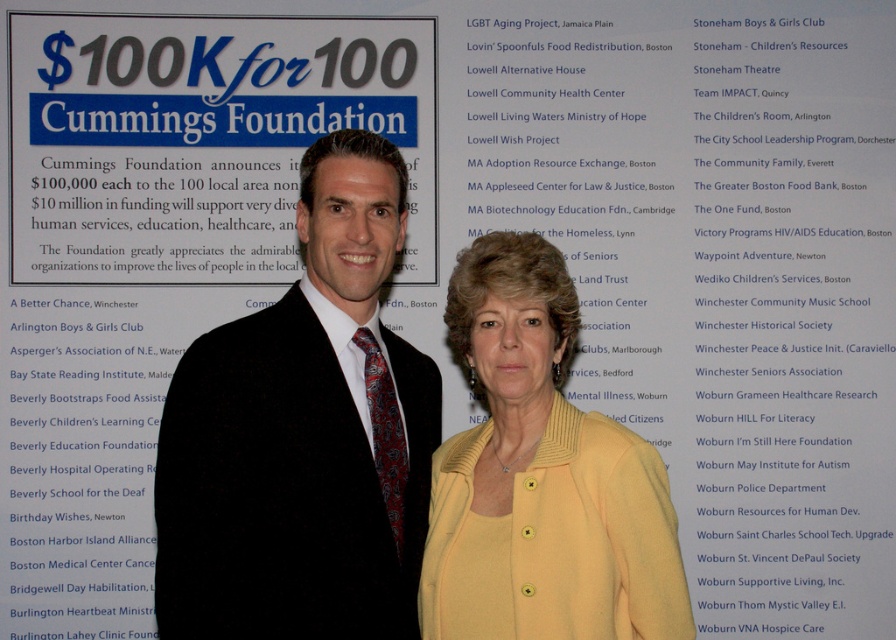
Question: Which object appears closest to the camera in this image?

Choices:
 (A) black velvet suit at center
 (B) yellow matte cardigan at center

Answer: (A)

Question: Which of the following is the closest to the observer?

Choices:
 (A) black velvet suit at center
 (B) yellow matte cardigan at center

Answer: (A)

Question: Where is black velvet suit at center located in relation to yellow matte cardigan at center in the image?

Choices:
 (A) left
 (B) right

Answer: (A)

Question: Is black velvet suit at center to the left of yellow matte cardigan at center from the viewer's perspective?

Choices:
 (A) yes
 (B) no

Answer: (A)

Question: Does black velvet suit at center appear under yellow matte cardigan at center?

Choices:
 (A) no
 (B) yes

Answer: (A)